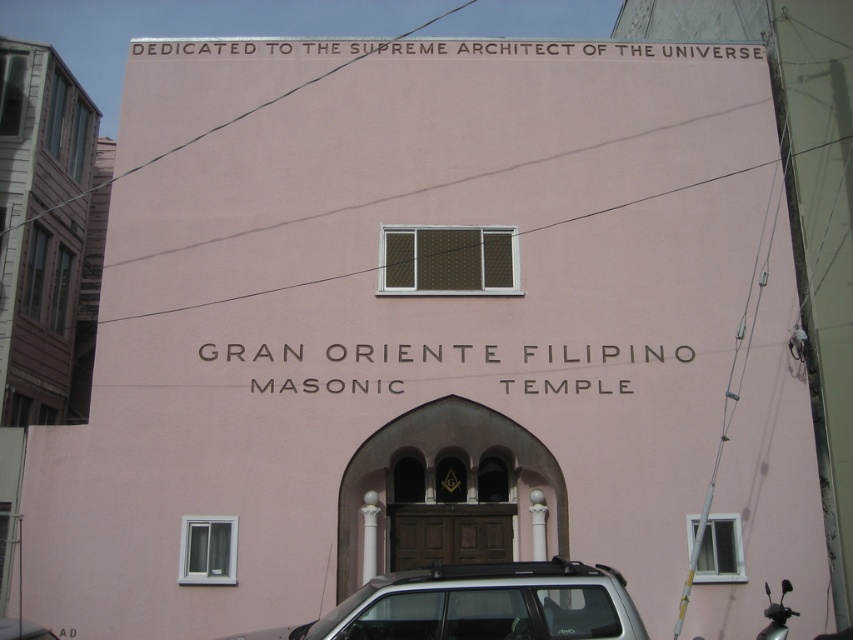
You are driving a car and want to park in the parking lot shown in the image. There is a silver metallic suv at lower center and a metallic silver motorcycle at lower right. Can you safely park your car between them without overlapping either vehicle?

The distance between the silver metallic suv at lower center and the metallic silver motorcycle at lower right is 6.39 meters. Assuming an average car length of about 4.5 meters, there is sufficient space to park your car between them without overlapping either vehicle.

You are standing in front of the Gran Oriente Filipino Masonic Temple and notice two points marked on the building. The first point is located at coordinates point [383,589] and the second at point [780,596]. Which of these two points is closer to you?

Point [383,589] is closer to the camera than point [780,596], so the first point is closer to you.

You are standing in front of the Gran Oriente Filipino Masonic Temple and want to take a photo of the silver metallic suv at lower center and the metallic silver motorcycle at lower right. Which vehicle should you focus on first to ensure it appears larger in your photo?

The silver metallic suv at lower center is closer to the viewer than the metallic silver motorcycle at lower right, so focusing on it first will make it appear larger in the photo.